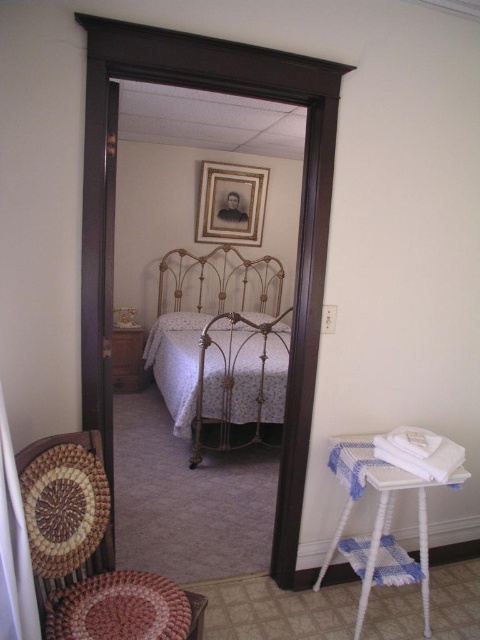
Question: Can you confirm if braided wood chair at lower left is positioned to the left of wrought iron bed at center?

Choices:
 (A) no
 (B) yes

Answer: (B)

Question: Estimate the real-world distances between objects in this image. Which object is closer to the white woven stool at lower right?

Choices:
 (A) gold/gilded picture frame at upper center
 (B) braided wood chair at lower left
 (C) gold wrought iron bed at center
 (D) gold-toned metal bed frame at center

Answer: (B)

Question: Which point is farther to the camera?

Choices:
 (A) gold wrought iron bed at center
 (B) braided wood chair at lower left

Answer: (A)

Question: Where is braided wood chair at lower left located in relation to gold/gilded picture frame at upper center in the image?

Choices:
 (A) below
 (B) above

Answer: (A)

Question: Which point is closer to the camera?

Choices:
 (A) (83, 612)
 (B) (153, 276)

Answer: (A)

Question: Is white woven stool at lower right bigger than wrought iron bed at center?

Choices:
 (A) yes
 (B) no

Answer: (B)